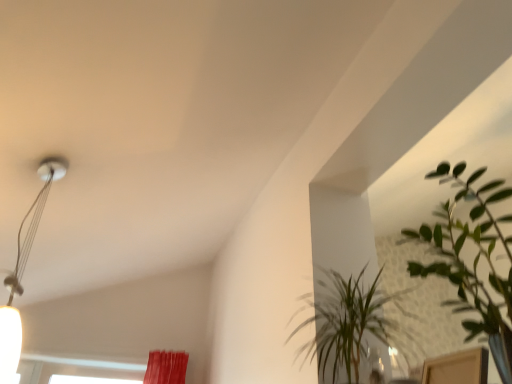
Question: Can we say green leafy plant at upper right, the 1th houseplant in the back-to-front sequence, lies outside metallic silver lamp at upper left?

Choices:
 (A) yes
 (B) no

Answer: (A)

Question: Can metallic silver lamp at upper left be found inside green leafy plant at upper right, acting as the second houseplant starting from the front?

Choices:
 (A) no
 (B) yes

Answer: (A)

Question: Is green leafy plant at upper right, the 1th houseplant in the back-to-front sequence, taller than metallic silver lamp at upper left?

Choices:
 (A) yes
 (B) no

Answer: (B)

Question: Is green leafy plant at upper right, acting as the second houseplant starting from the front, positioned before metallic silver lamp at upper left?

Choices:
 (A) yes
 (B) no

Answer: (A)

Question: Can you confirm if green leafy plant at upper right, the 1th houseplant in the back-to-front sequence, is bigger than metallic silver lamp at upper left?

Choices:
 (A) yes
 (B) no

Answer: (A)

Question: From their relative heights in the image, would you say green leafy plant at upper right, acting as the second houseplant starting from the front, is taller or shorter than green leafy plant at upper right, the 2th houseplant viewed from the back?

Choices:
 (A) tall
 (B) short

Answer: (B)

Question: From a real-world perspective, is green leafy plant at upper right, the 1th houseplant in the back-to-front sequence, physically located above or below green leafy plant at upper right, the 2th houseplant viewed from the back?

Choices:
 (A) below
 (B) above

Answer: (B)

Question: Considering the positions of green leafy plant at upper right, acting as the second houseplant starting from the front, and green leafy plant at upper right, the first houseplant in the front-to-back sequence, in the image, is green leafy plant at upper right, acting as the second houseplant starting from the front, bigger or smaller than green leafy plant at upper right, the first houseplant in the front-to-back sequence,?

Choices:
 (A) big
 (B) small

Answer: (B)

Question: Is green leafy plant at upper right, acting as the second houseplant starting from the front, to the left or to the right of green leafy plant at upper right, the first houseplant in the front-to-back sequence, in the image?

Choices:
 (A) right
 (B) left

Answer: (B)

Question: Looking at the image, does metallic silver lamp at upper left seem bigger or smaller compared to green leafy plant at upper right, the 1th houseplant in the back-to-front sequence?

Choices:
 (A) small
 (B) big

Answer: (A)

Question: In terms of height, does metallic silver lamp at upper left look taller or shorter compared to green leafy plant at upper right, acting as the second houseplant starting from the front?

Choices:
 (A) tall
 (B) short

Answer: (A)

Question: Is metallic silver lamp at upper left spatially inside green leafy plant at upper right, the 1th houseplant in the back-to-front sequence, or outside of it?

Choices:
 (A) inside
 (B) outside

Answer: (B)

Question: Considering their positions, is metallic silver lamp at upper left located in front of or behind green leafy plant at upper right, acting as the second houseplant starting from the front?

Choices:
 (A) front
 (B) behind

Answer: (B)

Question: Which is correct: green leafy plant at upper right, the 1th houseplant in the back-to-front sequence, is inside metallic silver lamp at upper left, or outside of it?

Choices:
 (A) outside
 (B) inside

Answer: (A)

Question: Considering the positions of point (372, 286) and point (24, 221), is point (372, 286) closer or farther from the camera than point (24, 221)?

Choices:
 (A) closer
 (B) farther

Answer: (A)